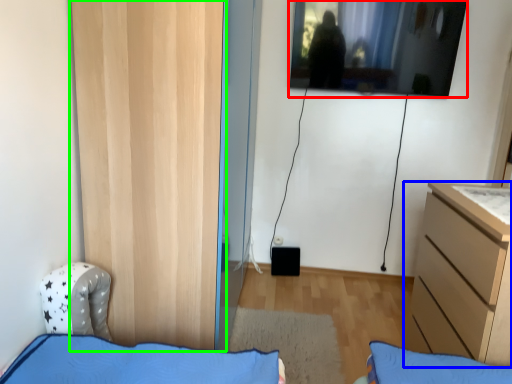
Question: Based on their relative distances, which object is farther from window (highlighted by a red box)? Choose from chest of drawers (highlighted by a blue box) and door (highlighted by a green box).

Choices:
 (A) chest of drawers
 (B) door

Answer: (B)